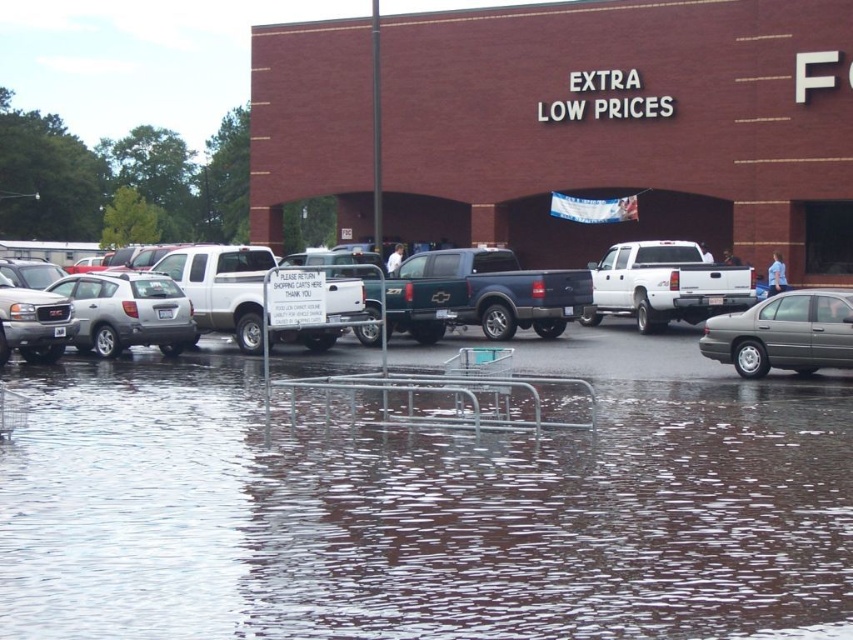
You are a delivery driver who needs to park your truck in the parking lot. The brown brick building at upper center and the satin silver suv at left are in your line of sight. Which object is bigger in your view?

The brown brick building at upper center is larger in size compared to the satin silver suv at left, so it appears bigger in your view.

You are standing in the parking lot and want to locate two specific points marked in the image. Which point, point 1 at coordinates [805,492] or point 2 at coordinates [158,321], is nearer to your current position?

Point 1 at coordinates [805,492] is closer to you because it is closer to the camera than point 2 at coordinates [158,321].